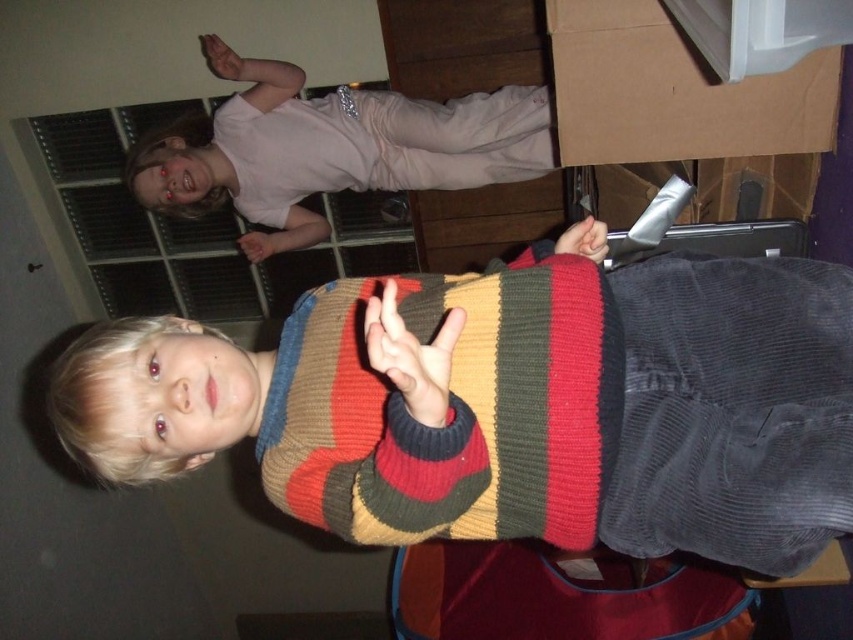
Question: Is striped sweater at center positioned in front of striped wool sweater at center?

Choices:
 (A) no
 (B) yes

Answer: (B)

Question: Among these points, which one is farthest from the camera?

Choices:
 (A) (106, 365)
 (B) (543, 428)

Answer: (A)

Question: Does striped sweater at center have a smaller size compared to striped wool sweater at center?

Choices:
 (A) yes
 (B) no

Answer: (B)

Question: Can you confirm if striped wool sweater at center is positioned to the left of matte pink shirt at upper left?

Choices:
 (A) no
 (B) yes

Answer: (A)

Question: Which point is closer to the camera taking this photo?

Choices:
 (A) (535, 317)
 (B) (741, 493)
 (C) (146, 172)

Answer: (B)

Question: Estimate the real-world distances between objects in this image. Which object is farther from the striped sweater at center?

Choices:
 (A) striped wool sweater at center
 (B) matte pink shirt at upper left

Answer: (B)